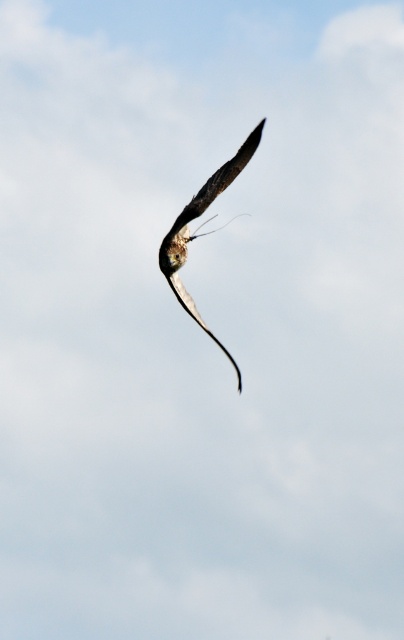
Question: Among these points, which one is farthest from the camera?

Choices:
 (A) (180, 300)
 (B) (170, 280)

Answer: (B)

Question: Does brown feathered bird at center appear under silvery metallic tail at center?

Choices:
 (A) yes
 (B) no

Answer: (B)

Question: Which point is closer to the camera?

Choices:
 (A) (185, 241)
 (B) (185, 296)

Answer: (B)

Question: Observing the image, what is the correct spatial positioning of brown feathered bird at center in reference to silvery metallic tail at center?

Choices:
 (A) above
 (B) below

Answer: (A)

Question: Is brown feathered bird at center to the left of silvery metallic tail at center from the viewer's perspective?

Choices:
 (A) no
 (B) yes

Answer: (A)